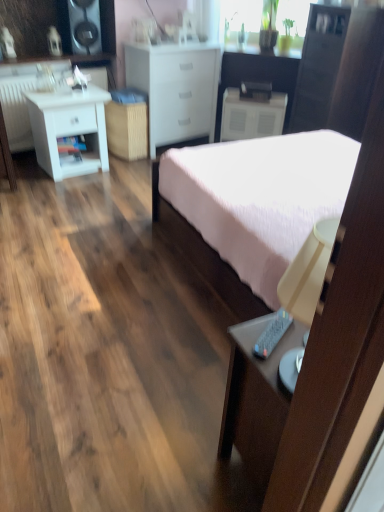
Question: From a real-world perspective, is white matte chest of drawers at center on pink fabric bed at center?

Choices:
 (A) yes
 (B) no

Answer: (A)

Question: Is white matte chest of drawers at center taller than pink fabric bed at center?

Choices:
 (A) no
 (B) yes

Answer: (B)

Question: From the image's perspective, is white matte chest of drawers at center located beneath pink fabric bed at center?

Choices:
 (A) yes
 (B) no

Answer: (B)

Question: Is white matte chest of drawers at center thinner than pink fabric bed at center?

Choices:
 (A) yes
 (B) no

Answer: (A)

Question: Considering the relative positions of white matte chest of drawers at center and pink fabric bed at center in the image provided, is white matte chest of drawers at center to the left of pink fabric bed at center from the viewer's perspective?

Choices:
 (A) no
 (B) yes

Answer: (B)

Question: Which is correct: matte black cabinet at upper right is inside black plastic remote control at lower right, or outside of it?

Choices:
 (A) outside
 (B) inside

Answer: (A)

Question: Looking at their shapes, would you say matte black cabinet at upper right is wider or thinner than black plastic remote control at lower right?

Choices:
 (A) thin
 (B) wide

Answer: (B)

Question: From the image's perspective, is matte black cabinet at upper right above or below black plastic remote control at lower right?

Choices:
 (A) above
 (B) below

Answer: (A)

Question: Considering the positions of matte black cabinet at upper right and black plastic remote control at lower right in the image, is matte black cabinet at upper right taller or shorter than black plastic remote control at lower right?

Choices:
 (A) short
 (B) tall

Answer: (B)

Question: In terms of width, does white matte nightstand at left, the first nightstand from the left, look wider or thinner when compared to white matte chest of drawers at center?

Choices:
 (A) wide
 (B) thin

Answer: (B)

Question: Is white matte nightstand at left, acting as the first nightstand starting from the front, taller or shorter than white matte chest of drawers at center?

Choices:
 (A) short
 (B) tall

Answer: (A)

Question: From the image's perspective, relative to white matte chest of drawers at center, is white matte nightstand at left, the first nightstand from the left, above or below?

Choices:
 (A) below
 (B) above

Answer: (A)

Question: Visually, is white matte nightstand at left, arranged as the 2th nightstand when viewed from the right, positioned to the left or to the right of white matte chest of drawers at center?

Choices:
 (A) left
 (B) right

Answer: (A)

Question: Does point (266, 349) appear closer or farther from the camera than point (188, 80)?

Choices:
 (A) farther
 (B) closer

Answer: (B)

Question: Looking at the image, does black plastic remote control at lower right seem bigger or smaller compared to white matte chest of drawers at center?

Choices:
 (A) big
 (B) small

Answer: (B)